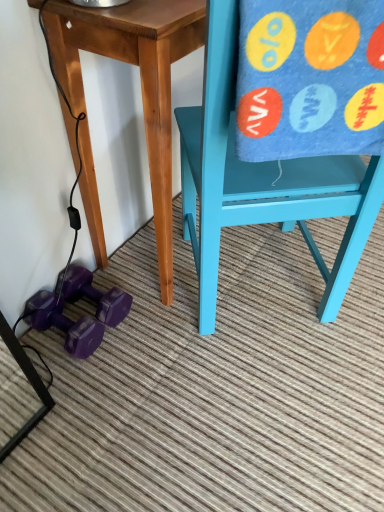
Locate an element on the screen. The height and width of the screenshot is (512, 384). matte blue chair at right is located at coordinates (262, 180).

How much space does purple rubber dumbbell at lower left, which is the 2th dumbbell in bottom-to-top order, occupy vertically?

It is 4.05 inches.

Describe the element at coordinates (96, 295) in the screenshot. This screenshot has height=512, width=384. I see `purple rubber dumbbell at lower left, which is the 2th dumbbell in bottom-to-top order` at that location.

Locate an element on the screen. blue felt beach towel at right is located at coordinates (310, 79).

Is purple rubber dumbbell at lower left, the 1th dumbbell from the bottom, at the right side of matte blue chair at right?

In fact, purple rubber dumbbell at lower left, the 1th dumbbell from the bottom, is to the left of matte blue chair at right.

Would you say purple rubber dumbbell at lower left, the 1th dumbbell from the bottom, is outside matte blue chair at right?

Absolutely, purple rubber dumbbell at lower left, the 1th dumbbell from the bottom, is external to matte blue chair at right.

From the image's perspective, is purple rubber dumbbell at lower left, the 1th dumbbell from the bottom, positioned above or below matte blue chair at right?

From the image's perspective, purple rubber dumbbell at lower left, the 1th dumbbell from the bottom, appears below matte blue chair at right.

How far apart are purple rubber dumbbell at lower left, the second dumbbell in the top-to-bottom sequence, and matte blue chair at right?

A distance of 19.94 inches exists between purple rubber dumbbell at lower left, the second dumbbell in the top-to-bottom sequence, and matte blue chair at right.

Which is more to the right, wooden table at center or purple rubber dumbbell at lower left, the second dumbbell in the top-to-bottom sequence?

wooden table at center.

What's the angular difference between wooden table at center and purple rubber dumbbell at lower left, the 1th dumbbell from the bottom,'s facing directions?

There is a 4.01-degree angle between the facing directions of wooden table at center and purple rubber dumbbell at lower left, the 1th dumbbell from the bottom.

Can purple rubber dumbbell at lower left, the second dumbbell in the top-to-bottom sequence, be found inside wooden table at center?

No, purple rubber dumbbell at lower left, the second dumbbell in the top-to-bottom sequence, is not inside wooden table at center.

Is wooden table at center shorter than purple rubber dumbbell at lower left, the 1th dumbbell from the bottom?

In fact, wooden table at center may be taller than purple rubber dumbbell at lower left, the 1th dumbbell from the bottom.

Is there a large distance between matte blue chair at right and wooden table at center?

matte blue chair at right is actually quite close to wooden table at center.

Is matte blue chair at right facing away from wooden table at center?

No, wooden table at center is not at the back of matte blue chair at right.

From the image's perspective, is matte blue chair at right located beneath wooden table at center?

Yes, from the image's perspective, matte blue chair at right is beneath wooden table at center.

Choose the correct answer: Is wooden table at center inside blue felt beach towel at right or outside it?

wooden table at center cannot be found inside blue felt beach towel at right.

Which object is positioned more to the left, wooden table at center or blue felt beach towel at right?

Positioned to the left is wooden table at center.

From a real-world perspective, who is located higher, wooden table at center or blue felt beach towel at right?

blue felt beach towel at right, from a real-world perspective.

How many degrees apart are the facing directions of matte blue chair at right and blue felt beach towel at right?

0.000144 degrees.

Which of these two, matte blue chair at right or blue felt beach towel at right, is wider?

matte blue chair at right.

Does point (343, 181) lie in front of point (244, 16)?

No, it is behind (244, 16).

Would you say blue felt beach towel at right is part of matte blue chair at right's contents?

Yes, blue felt beach towel at right can be found within matte blue chair at right.

Would you say purple rubber dumbbell at lower left, the 1th dumbbell from the bottom, is outside wooden table at center?

Yes.

Which point is more forward, (81, 330) or (133, 38)?

Positioned in front is point (133, 38).

Which object is further away from the camera taking this photo, purple rubber dumbbell at lower left, the 1th dumbbell from the bottom, or wooden table at center?

purple rubber dumbbell at lower left, the 1th dumbbell from the bottom, is more distant.

Measure the distance between purple rubber dumbbell at lower left, the 1th dumbbell from the bottom, and wooden table at center.

purple rubber dumbbell at lower left, the 1th dumbbell from the bottom, and wooden table at center are 16.50 inches apart from each other.

I want to click on chair lying on the right of purple rubber dumbbell at lower left, the second dumbbell in the top-to-bottom sequence, so click(x=262, y=180).

From the image's perspective, which is below, matte blue chair at right or purple rubber dumbbell at lower left, the second dumbbell in the top-to-bottom sequence?

purple rubber dumbbell at lower left, the second dumbbell in the top-to-bottom sequence, appears lower in the image.

From a real-world perspective, which is physically above, matte blue chair at right or purple rubber dumbbell at lower left, the 1th dumbbell from the bottom?

matte blue chair at right is physically above.

Is matte blue chair at right looking in the opposite direction of purple rubber dumbbell at lower left, the second dumbbell in the top-to-bottom sequence?

No, matte blue chair at right is not facing away from purple rubber dumbbell at lower left, the second dumbbell in the top-to-bottom sequence.

Where is `chair above the purple rubber dumbbell at lower left, the second dumbbell in the top-to-bottom sequence (from a real-world perspective)`? chair above the purple rubber dumbbell at lower left, the second dumbbell in the top-to-bottom sequence (from a real-world perspective) is located at coordinates coord(262,180).

At what (x,y) coordinates should I click in order to perform the action: click on the 2nd dumbbell positioned below the wooden table at center (from a real-world perspective). Please return your answer as a coordinate pair (x, y). The image size is (384, 512). Looking at the image, I should click on (64, 323).

When comparing their distances from matte blue chair at right, does blue felt beach towel at right or purple rubber dumbbell at lower left, which is the 2th dumbbell in bottom-to-top order, seem closer?

Based on the image, blue felt beach towel at right appears to be nearer to matte blue chair at right.

Looking at the image, which one is located closer to matte blue chair at right, wooden table at center or purple rubber dumbbell at lower left, which is the 2th dumbbell in bottom-to-top order?

The object closer to matte blue chair at right is wooden table at center.

Looking at the image, which one is located further to matte blue chair at right, purple rubber dumbbell at lower left, the second dumbbell in the top-to-bottom sequence, or blue felt beach towel at right?

Among the two, purple rubber dumbbell at lower left, the second dumbbell in the top-to-bottom sequence, is located further to matte blue chair at right.

Estimate the real-world distances between objects in this image. Which object is closer to purple rubber dumbbell at lower left, the second dumbbell in the top-to-bottom sequence, wooden table at center or blue felt beach towel at right?

The object closer to purple rubber dumbbell at lower left, the second dumbbell in the top-to-bottom sequence, is wooden table at center.

From the image, which object appears to be nearer to matte blue chair at right, purple rubber dumbbell at lower left, which ranks as the 1th dumbbell in top-to-bottom order, or blue felt beach towel at right?

blue felt beach towel at right is closer to matte blue chair at right.

When comparing their distances from purple rubber dumbbell at lower left, which ranks as the 1th dumbbell in top-to-bottom order, does blue felt beach towel at right or wooden table at center seem further?

The object further to purple rubber dumbbell at lower left, which ranks as the 1th dumbbell in top-to-bottom order, is blue felt beach towel at right.

Based on their spatial positions, is matte blue chair at right or purple rubber dumbbell at lower left, which ranks as the 1th dumbbell in top-to-bottom order, closer to blue felt beach towel at right?

matte blue chair at right is closer to blue felt beach towel at right.

Estimate the real-world distances between objects in this image. Which object is further from purple rubber dumbbell at lower left, which ranks as the 1th dumbbell in top-to-bottom order, blue felt beach towel at right or purple rubber dumbbell at lower left, the second dumbbell in the top-to-bottom sequence?

blue felt beach towel at right.

This screenshot has width=384, height=512. What are the coordinates of `table between matte blue chair at right and purple rubber dumbbell at lower left, which ranks as the 1th dumbbell in top-to-bottom order, from front to back` in the screenshot? It's located at (140, 77).

Where is `dumbbell between blue felt beach towel at right and purple rubber dumbbell at lower left, which is the 2th dumbbell in bottom-to-top order, along the z-axis`? This screenshot has height=512, width=384. dumbbell between blue felt beach towel at right and purple rubber dumbbell at lower left, which is the 2th dumbbell in bottom-to-top order, along the z-axis is located at coordinates (64, 323).

Locate an element on the screen. dumbbell between matte blue chair at right and purple rubber dumbbell at lower left, which is the 2th dumbbell in bottom-to-top order, from front to back is located at coordinates (64, 323).

Locate an element on the screen. table between purple rubber dumbbell at lower left, the 1th dumbbell from the bottom, and blue felt beach towel at right, in the horizontal direction is located at coordinates (140, 77).